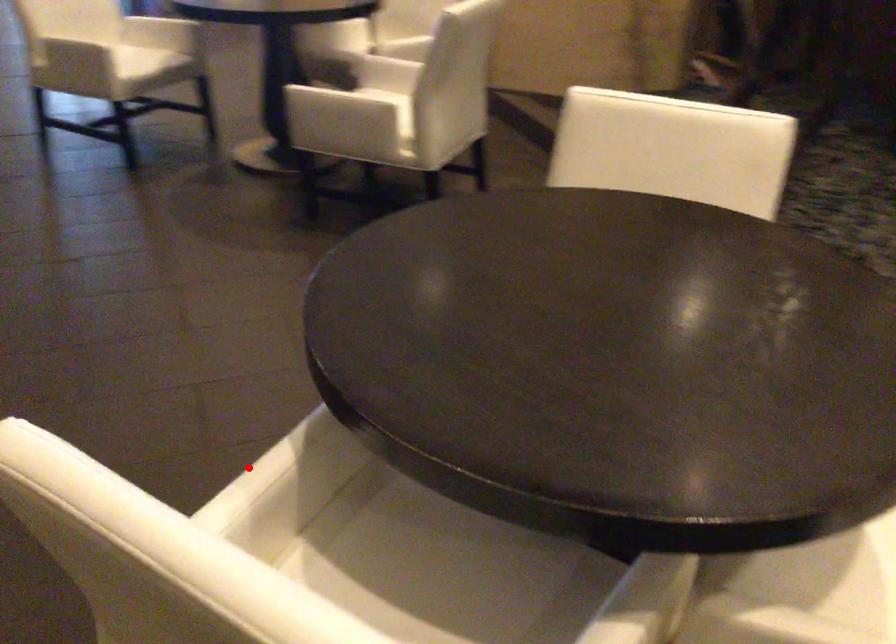
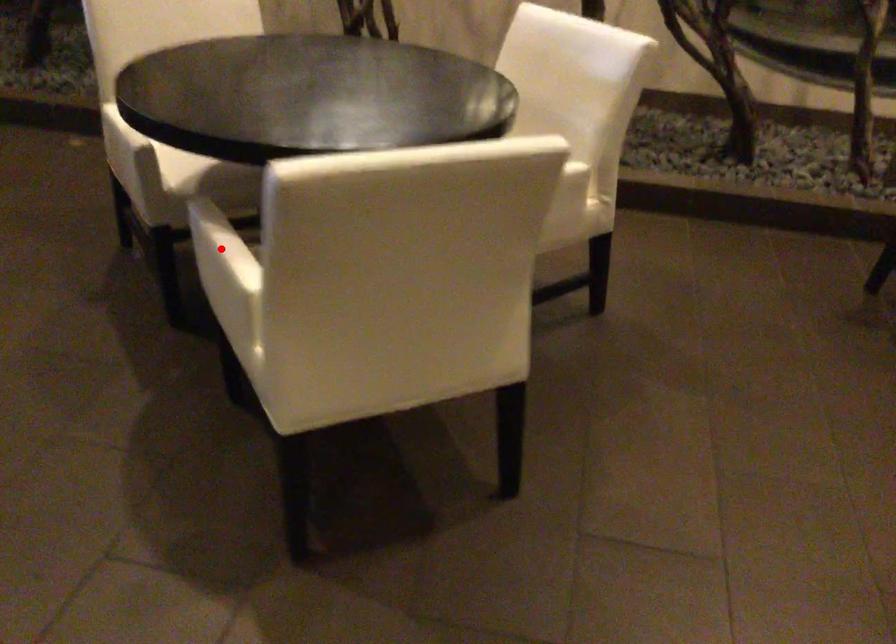
I am providing you with two images of the same scene from different viewpoints. A red point is marked on the first image and another point is marked on the second image. Do the highlighted points in image1 and image2 indicate the same real-world spot?

Yes